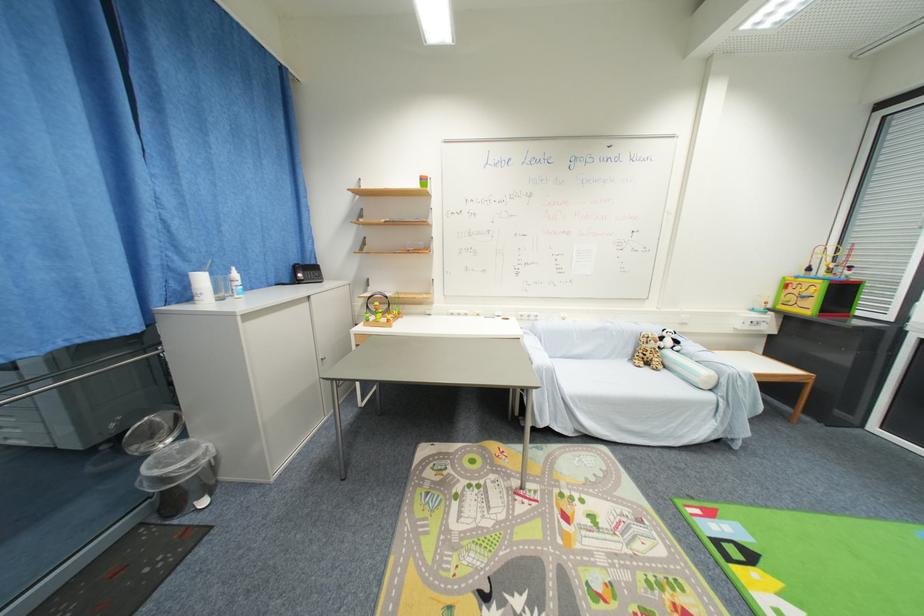
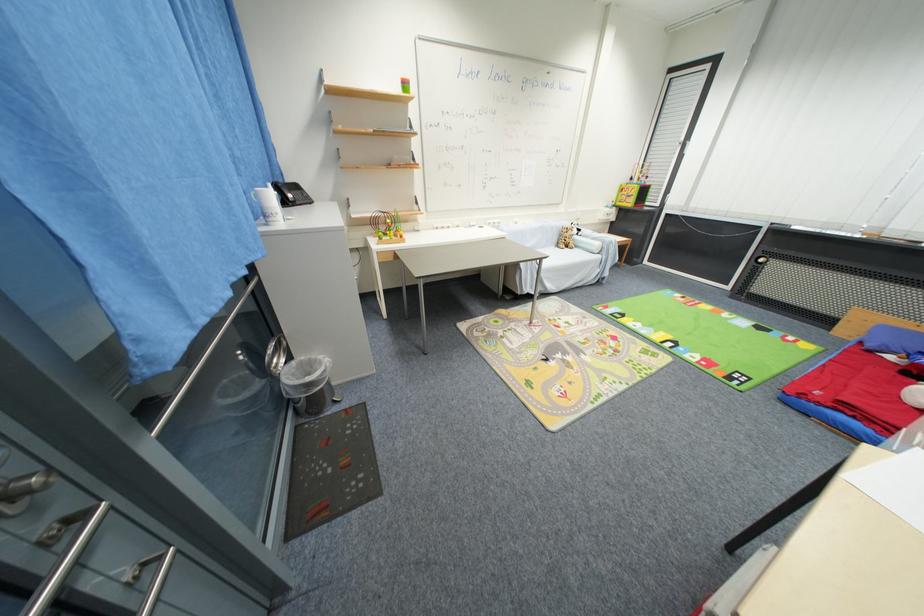
In the second image, find the point that corresponds to (x=714, y=399) in the first image.

(603, 259)